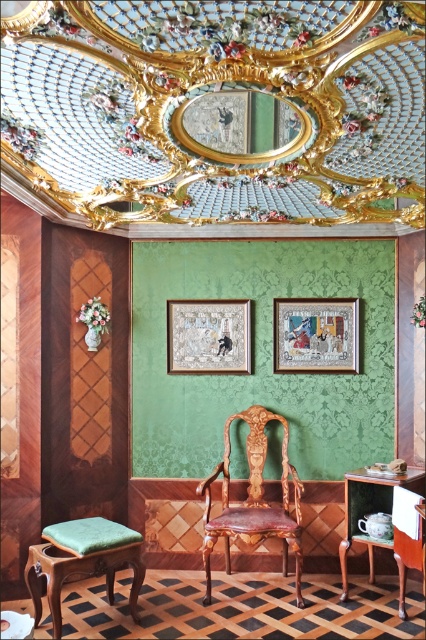
Question: Which object appears farthest from the camera in this image?

Choices:
 (A) green velvet stool at lower left
 (B) porcelain teacup at lower right
 (C) polished wood armchair at center

Answer: (C)

Question: Which point is closer to the camera?

Choices:
 (A) (351, 474)
 (B) (236, 339)

Answer: (A)

Question: Can you confirm if matte gold picture frame at center is positioned to the right of wooden framed picture at center?

Choices:
 (A) no
 (B) yes

Answer: (B)

Question: Does matte gold picture frame at center have a lesser width compared to porcelain teacup at lower right?

Choices:
 (A) yes
 (B) no

Answer: (A)

Question: Is polished wood armchair at center thinner than matte gold picture frame at center?

Choices:
 (A) yes
 (B) no

Answer: (B)

Question: Which of these objects is positioned closest to the porcelain teacup at lower right?

Choices:
 (A) matte gold picture frame at center
 (B) polished wood armchair at center
 (C) green velvet stool at lower left

Answer: (B)